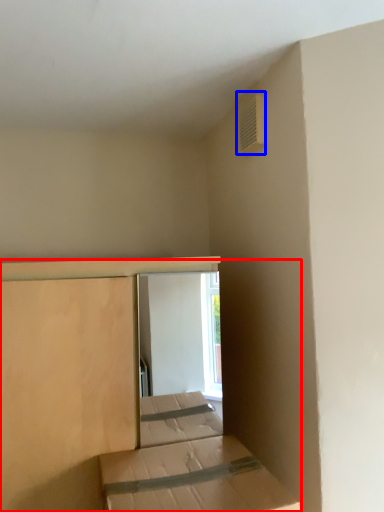
Question: Which object appears farthest to the camera in this image, bed (highlighted by a red box) or air conditioning (highlighted by a blue box)?

Choices:
 (A) bed
 (B) air conditioning

Answer: (B)